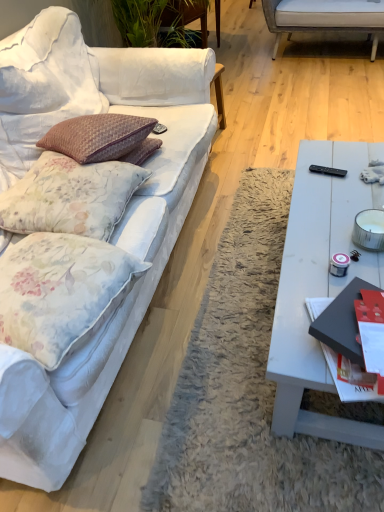
Locate an element on the screen. The width and height of the screenshot is (384, 512). vacant area situated to the left side of white matte coffee table at right is located at coordinates point(228,337).